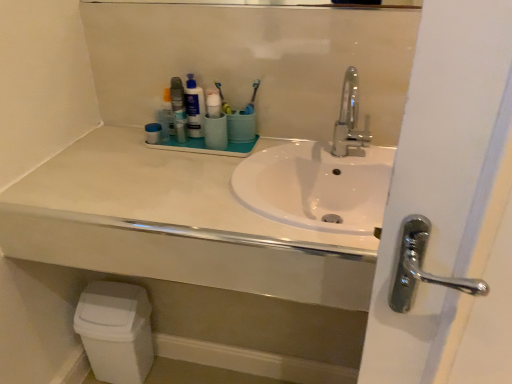
Where is `matte plastic container at upper center, which is counted as the 3th toiletry, starting from the right`? matte plastic container at upper center, which is counted as the 3th toiletry, starting from the right is located at coordinates (153, 133).

Measure the distance between matte plastic container at upper center, which is counted as the 3th toiletry, starting from the right, and camera.

matte plastic container at upper center, which is counted as the 3th toiletry, starting from the right, is 1.39 meters away from camera.

Identify the location of white glossy toothpaste tube at center, which is the 2th toiletry in left-to-right order. (213, 103).

The image size is (512, 384). What do you see at coordinates (213, 103) in the screenshot?
I see `white glossy toothpaste tube at center, which is the 2th toiletry in left-to-right order` at bounding box center [213, 103].

In order to face white plastic toothbrush at center, placed as the 2th toothbrush when sorted from right to left, should I rotate leftwards or rightwards?

A 4.365 degree turn to the left will do.

What do you see at coordinates (223, 100) in the screenshot? Image resolution: width=512 pixels, height=384 pixels. I see `white plastic toothbrush at center, the first toothbrush in the left-to-right sequence` at bounding box center [223, 100].

Describe the element at coordinates (178, 109) in the screenshot. I see `matte plastic mouthwash at center` at that location.

Locate an element on the screen. This screenshot has width=512, height=384. matte blue cup at center, which is the 1th toiletry from right to left is located at coordinates (215, 122).

Find the location of `matte plastic container at upper center, which is the 1th toiletry in left-to-right order`. matte plastic container at upper center, which is the 1th toiletry in left-to-right order is located at coordinates (153, 133).

From the image's perspective, relative to blue glossy lotion at center, is matte plastic mouthwash at center above or below?

From the image's perspective, matte plastic mouthwash at center appears below blue glossy lotion at center.

Does matte plastic mouthwash at center lie in front of blue glossy lotion at center?

That is True.

From a real-world perspective, is matte plastic mouthwash at center physically below blue glossy lotion at center?

Actually, matte plastic mouthwash at center is physically above blue glossy lotion at center in the real world.

In terms of height, does matte plastic mouthwash at center look taller or shorter compared to blue glossy lotion at center?

In the image, matte plastic mouthwash at center appears to be shorter than blue glossy lotion at center.

Consider the image. What's the angular difference between matte plastic container at upper center, which is the 1th toiletry in left-to-right order, and blue glossy lotion at center's facing directions?

There is a 0.00132-degree angle between the facing directions of matte plastic container at upper center, which is the 1th toiletry in left-to-right order, and blue glossy lotion at center.

Is there a large distance between matte plastic container at upper center, which is counted as the 3th toiletry, starting from the right, and blue glossy lotion at center?

No.

Which is behind, point (156, 142) or point (193, 115)?

The point (193, 115) is farther from the camera.

Measure the distance from matte plastic container at upper center, which is the 1th toiletry in left-to-right order, to blue glossy lotion at center.

They are 5.38 inches apart.

Is white plastic toothbrush at center, the first toothbrush in the left-to-right sequence, completely or partially outside of blue glossy lotion at center?

Absolutely, white plastic toothbrush at center, the first toothbrush in the left-to-right sequence, is external to blue glossy lotion at center.

Is white plastic toothbrush at center, placed as the 2th toothbrush when sorted from right to left, taller than blue glossy lotion at center?

In fact, white plastic toothbrush at center, placed as the 2th toothbrush when sorted from right to left, may be shorter than blue glossy lotion at center.

From the image's perspective, which one is positioned higher, white plastic toothbrush at center, placed as the 2th toothbrush when sorted from right to left, or blue glossy lotion at center?

white plastic toothbrush at center, placed as the 2th toothbrush when sorted from right to left, appears higher in the image.

Based on their sizes in the image, would you say matte plastic mouthwash at center is bigger or smaller than white matte countertop at center?

Considering their sizes, matte plastic mouthwash at center takes up less space than white matte countertop at center.

Consider the image. From a real-world perspective, which is physically below, matte plastic mouthwash at center or white matte countertop at center?

white matte countertop at center, from a real-world perspective.

Is the depth of matte plastic mouthwash at center greater than that of white matte countertop at center?

Yes.

Which is closer, (177, 105) or (270, 255)?

Point (177, 105) appears to be farther away from the viewer than point (270, 255).

Considering the relative positions of matte plastic container at upper center, which is counted as the 3th toiletry, starting from the right, and white matte countertop at center in the image provided, is matte plastic container at upper center, which is counted as the 3th toiletry, starting from the right, to the left of white matte countertop at center from the viewer's perspective?

Correct, you'll find matte plastic container at upper center, which is counted as the 3th toiletry, starting from the right, to the left of white matte countertop at center.

Which of these two, matte plastic container at upper center, which is the 1th toiletry in left-to-right order, or white matte countertop at center, is smaller?

Smaller between the two is matte plastic container at upper center, which is the 1th toiletry in left-to-right order.

From the image's perspective, which is below, matte plastic container at upper center, which is the 1th toiletry in left-to-right order, or white matte countertop at center?

white matte countertop at center is shown below in the image.

Relative to white matte countertop at center, is matte plastic container at upper center, which is the 1th toiletry in left-to-right order, in front or behind?

Visually, matte plastic container at upper center, which is the 1th toiletry in left-to-right order, is located behind white matte countertop at center.

Who is bigger, matte plastic container at upper center, which is the 1th toiletry in left-to-right order, or matte blue cup at center, which is the 1th toiletry from right to left?

With larger size is matte blue cup at center, which is the 1th toiletry from right to left.

Is matte plastic container at upper center, which is the 1th toiletry in left-to-right order, directly adjacent to matte blue cup at center, which is the 1th toiletry from right to left?

No, matte plastic container at upper center, which is the 1th toiletry in left-to-right order, is not making contact with matte blue cup at center, which is the 1th toiletry from right to left.

Is matte plastic container at upper center, which is the 1th toiletry in left-to-right order, in front of matte blue cup at center, the third toiletry when ordered from left to right?

No, the depth of matte plastic container at upper center, which is the 1th toiletry in left-to-right order, is greater than that of matte blue cup at center, the third toiletry when ordered from left to right.

Is matte plastic container at upper center, which is the 1th toiletry in left-to-right order, spatially inside matte blue cup at center, which is the 1th toiletry from right to left, or outside of it?

matte plastic container at upper center, which is the 1th toiletry in left-to-right order, is located beyond the bounds of matte blue cup at center, which is the 1th toiletry from right to left.

Between polished chrome faucet at center and white plastic toothbrush at center, the first toothbrush in the left-to-right sequence, which one has smaller size?

white plastic toothbrush at center, the first toothbrush in the left-to-right sequence, is smaller.

Can you tell me how much polished chrome faucet at center and white plastic toothbrush at center, placed as the 2th toothbrush when sorted from right to left, differ in facing direction?

0.873 degrees.

Is polished chrome faucet at center in contact with white plastic toothbrush at center, the first toothbrush in the left-to-right sequence?

No, polished chrome faucet at center is not making contact with white plastic toothbrush at center, the first toothbrush in the left-to-right sequence.

Measure the distance from polished chrome faucet at center to white plastic toothbrush at center, the first toothbrush in the left-to-right sequence.

polished chrome faucet at center is 14.70 inches from white plastic toothbrush at center, the first toothbrush in the left-to-right sequence.

Identify the location of cleaning product below the matte plastic mouthwash at center (from a real-world perspective). (194, 107).

Find the location of a particular element. cleaning product in front of the matte plastic container at upper center, which is counted as the 3th toiletry, starting from the right is located at coordinates (194, 107).

When comparing their distances from white glossy toothpaste tube at center, which is the 2th toiletry in left-to-right order, does matte plastic container at upper center, which is the 1th toiletry in left-to-right order, or white matte countertop at center seem further?

The object further to white glossy toothpaste tube at center, which is the 2th toiletry in left-to-right order, is white matte countertop at center.

Considering their positions, is white glossy toothpaste tube at center, the 2th toiletry positioned from the right, positioned further to blue plastic toothbrush at center, the 2th toothbrush viewed from the left, than blue glossy lotion at center?

Based on the image, blue glossy lotion at center appears to be further to blue plastic toothbrush at center, the 2th toothbrush viewed from the left.

When comparing their distances from matte plastic mouthwash at center, does white glossy toothpaste tube at center, the 2th toiletry positioned from the right, or white matte countertop at center seem further?

Among the two, white matte countertop at center is located further to matte plastic mouthwash at center.

From the image, which object appears to be farther from matte plastic mouthwash at center, white glossy toothpaste tube at center, the 2th toiletry positioned from the right, or matte blue cup at center, the third toiletry when ordered from left to right?

matte blue cup at center, the third toiletry when ordered from left to right, is positioned further to the anchor matte plastic mouthwash at center.

Looking at the image, which one is located further to polished chrome faucet at center, matte blue cup at center, which is the 1th toiletry from right to left, or blue glossy lotion at center?

The object further to polished chrome faucet at center is blue glossy lotion at center.

Looking at the image, which one is located further to polished chrome faucet at center, matte blue cup at center, which is the 1th toiletry from right to left, or white matte countertop at center?

white matte countertop at center.

Considering their positions, is white plastic toothbrush at center, the first toothbrush in the left-to-right sequence, positioned closer to polished chrome faucet at center than white matte countertop at center?

white plastic toothbrush at center, the first toothbrush in the left-to-right sequence, is closer to polished chrome faucet at center.

Which object lies further to the anchor point white plastic toothbrush at center, the first toothbrush in the left-to-right sequence, white glossy toothpaste tube at center, which is the 2th toiletry in left-to-right order, or white matte countertop at center?

Based on the image, white matte countertop at center appears to be further to white plastic toothbrush at center, the first toothbrush in the left-to-right sequence.

You are a GUI agent. You are given a task and a screenshot of the screen. Output one action in this format:
    pyautogui.click(x=<x>, y=<y>)
    Task: Click on the mouthwash situated between matte plastic container at upper center, which is the 1th toiletry in left-to-right order, and blue glossy lotion at center from left to right
    The height and width of the screenshot is (384, 512).
    Given the screenshot: What is the action you would take?
    [x=178, y=109]

Image resolution: width=512 pixels, height=384 pixels. Identify the location of toothbrush between white plastic toothbrush at center, placed as the 2th toothbrush when sorted from right to left, and polished chrome faucet at center from left to right. pyautogui.click(x=252, y=99).

Identify the location of toiletry between white glossy toothpaste tube at center, which is the 2th toiletry in left-to-right order, and polished chrome faucet at center, in the horizontal direction. The height and width of the screenshot is (384, 512). (215, 122).

Where is `toiletry between white plastic toothbrush at center, the first toothbrush in the left-to-right sequence, and matte blue cup at center, the third toiletry when ordered from left to right, vertically`? The image size is (512, 384). toiletry between white plastic toothbrush at center, the first toothbrush in the left-to-right sequence, and matte blue cup at center, the third toiletry when ordered from left to right, vertically is located at coordinates (213, 103).